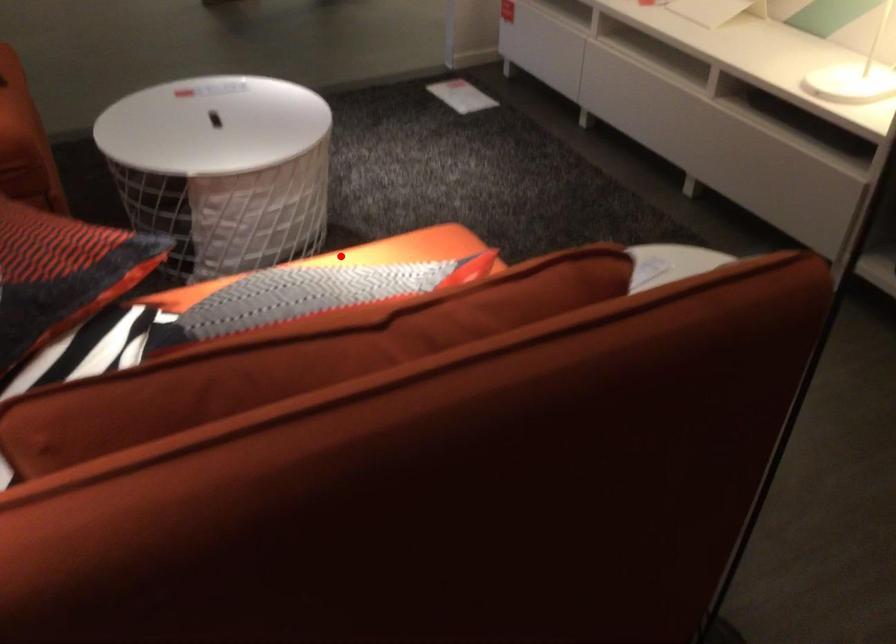
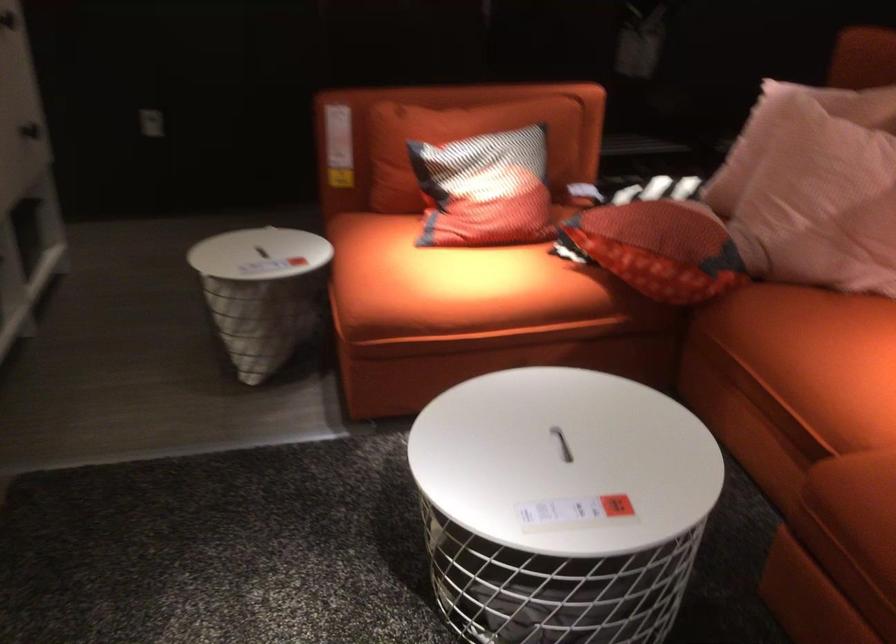
Question: A red point is marked in image1. In image2, is the corresponding 3D point closer to the camera or farther? Reply with the corresponding letter.

Choices:
 (A) The corresponding 3D point is closer.
 (B) The corresponding 3D point is farther.

Answer: (B)